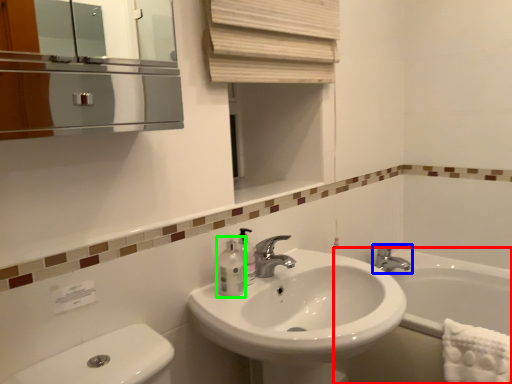
Question: Which is farther away from bath (highlighted by a red box)? tap (highlighted by a blue box) or mouthwash (highlighted by a green box)?

Choices:
 (A) tap
 (B) mouthwash

Answer: (B)